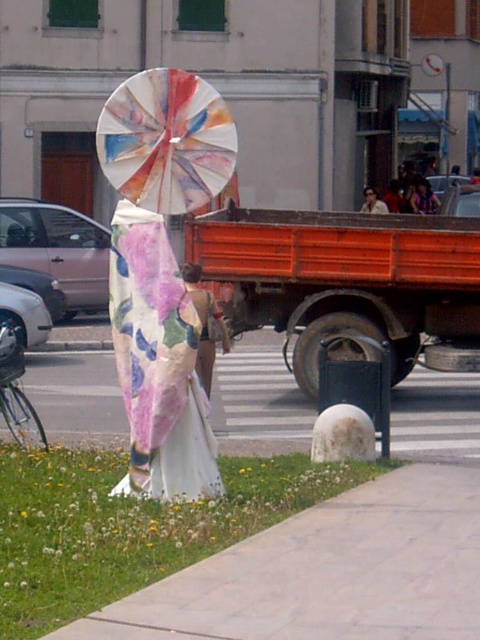
You are a delivery person who needs to place a small package on the ground. You see the white stone pavement at lower right and the floral silk dress at center. Which surface is more suitable for placing the package?

The white stone pavement at lower right is bigger than the floral silk dress at center, so the white stone pavement at lower right is more suitable for placing the package.

You are a photographer setting up a shoot in this location. You want to ensure that both the painted paper umbrella at center and the matte floral dress at center are clearly visible in the shot. Given their distance apart, what is the minimum focal length you should use to capture both subjects without distortion?

The painted paper umbrella at center and the matte floral dress at center are 15.80 feet apart. To capture both subjects without distortion, the photographer should use a focal length of at least 50mm, as wider angles below this may cause distortion at such distances.

You are a photographer trying to capture a photo of the person holding the parasol. You want to ensure both points, point (415, 518) and point (157, 122), are visible in the frame. Which point will appear larger in your photo?

Point (415, 518) is closer to the camera than point (157, 122), so it will appear larger in the photo.